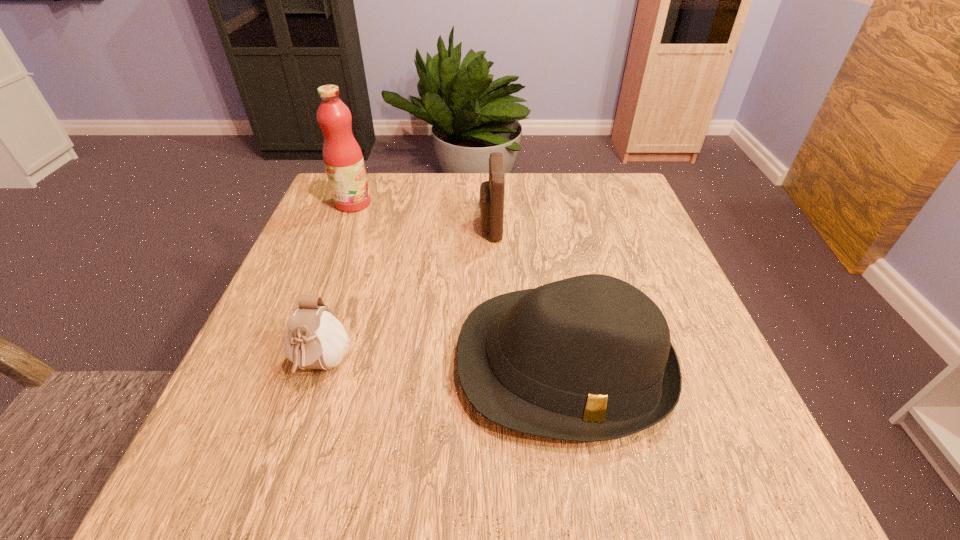
This screenshot has width=960, height=540. Identify the location of free location at the near edge of the desktop. (588, 453).

This screenshot has height=540, width=960. I want to click on vacant space at the left edge, so click(364, 230).

Where is `free space at the right edge of the desktop`? free space at the right edge of the desktop is located at coordinates (622, 223).

Where is `free spot at the far left corner of the desktop`? This screenshot has height=540, width=960. free spot at the far left corner of the desktop is located at coordinates (372, 190).

Locate an element on the screen. This screenshot has width=960, height=540. vacant region at the near right corner is located at coordinates (687, 501).

Locate an element on the screen. The width and height of the screenshot is (960, 540). vacant area between the fedora and the fruit juice is located at coordinates (458, 284).

Where is `blank region between the taller pouch and the fruit juice`? The image size is (960, 540). blank region between the taller pouch and the fruit juice is located at coordinates (421, 215).

Find the location of a particular element. The image size is (960, 540). free space between the shortest object and the tallest object is located at coordinates (337, 285).

This screenshot has width=960, height=540. Identify the location of free space that is in between the fedora and the shorter pouch. (443, 365).

What are the coordinates of `vacant space that's between the fruit juice and the right pouch` in the screenshot? It's located at (421, 215).